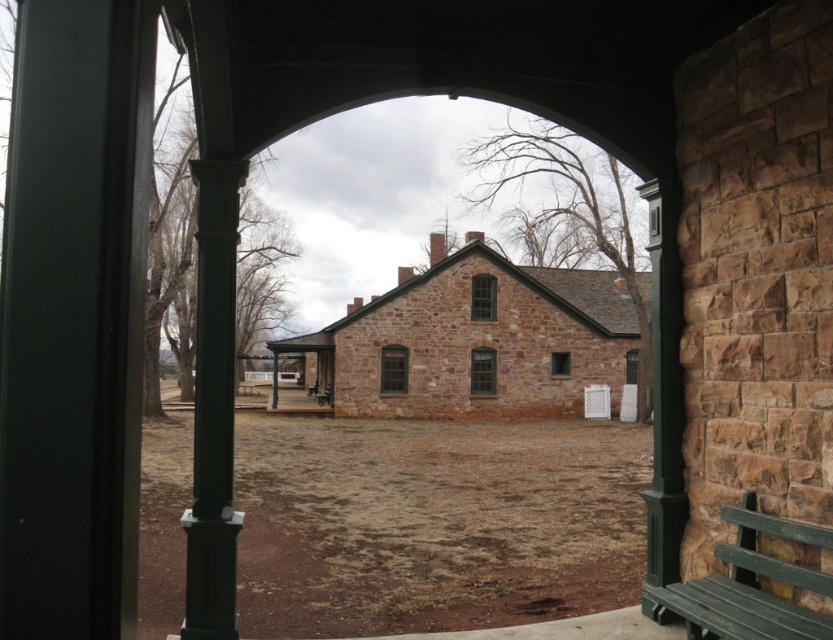
Based on the photo, you are a painter who needs to choose between the green painted wood post at left and the green wood bench at lower right to paint next. Which object requires more paint due to its larger surface area?

The green wood bench at lower right requires more paint because it is thicker than the green painted wood post at left, indicating a larger surface area.

You are standing at the entrance of the courtyard and see two points marked on the ground. The first point is labeled as point (x=552, y=577) and the second is point (x=230, y=540). Which point is closer to the two story stone building?

Point (x=552, y=577) is behind point (x=230, y=540), so the point closer to the two story stone building is point (x=230, y=540).